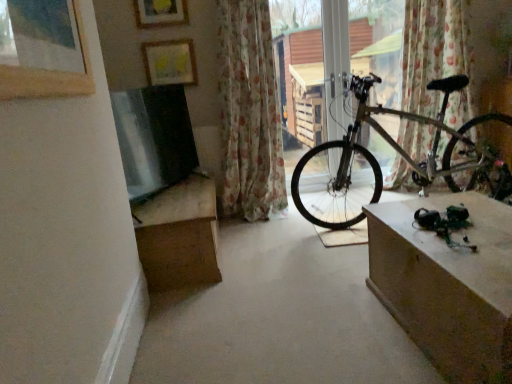
Where is `free space to the left of matte brown table at right`? free space to the left of matte brown table at right is located at coordinates (318, 323).